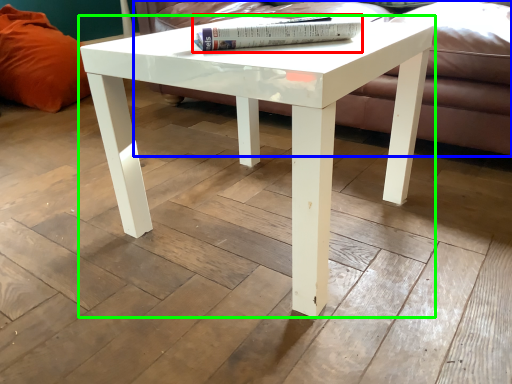
Question: Which object is the closest to the book (highlighted by a red box)? Choose among these: couch (highlighted by a blue box) or coffee table (highlighted by a green box).

Choices:
 (A) couch
 (B) coffee table

Answer: (B)